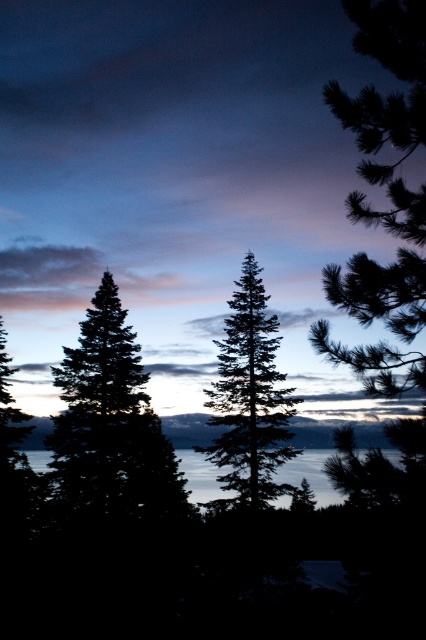
Question: In this image, where is silhouette pine tree at center located relative to green matte tree at center?

Choices:
 (A) below
 (B) above

Answer: (A)

Question: Which point appears closest to the camera in this image?

Choices:
 (A) (279, 428)
 (B) (244, 83)

Answer: (A)

Question: Estimate the real-world distances between objects in this image. Which object is closer to the green matte tree at center?

Choices:
 (A) silhouette pine trees at left
 (B) silhouette pine tree at center

Answer: (B)

Question: Among these points, which one is farthest from the camera?

Choices:
 (A) (178, 472)
 (B) (253, 456)

Answer: (A)

Question: Is silhouette pine tree at center below green matte tree at center?

Choices:
 (A) yes
 (B) no

Answer: (A)

Question: Where is silhouette pine trees at left located in relation to green matte tree at center in the image?

Choices:
 (A) below
 (B) above

Answer: (B)